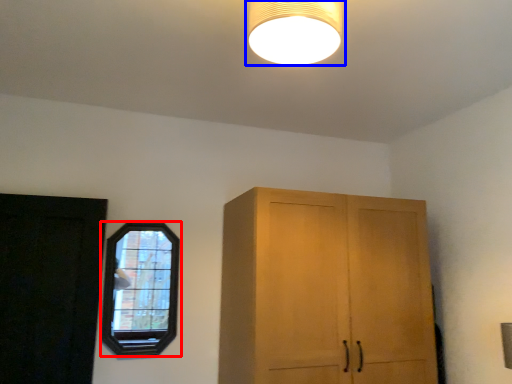
Question: Among these objects, which one is farthest to the camera, window (highlighted by a red box) or lamp (highlighted by a blue box)?

Choices:
 (A) window
 (B) lamp

Answer: (A)